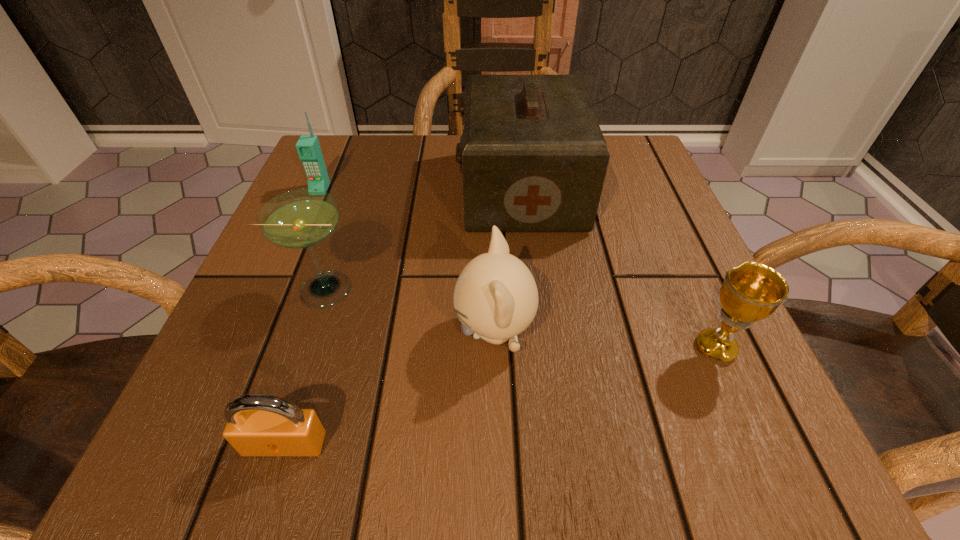
Point out which object is positioned as the fifth nearest to the first-aid kit. Please provide its 2D coordinates. Your answer should be formatted as a tuple, i.e. [(x, y)], where the tuple contains the x and y coordinates of a point satisfying the conditions above.

[(257, 424)]

Select which object is the third closest to the tallest object. Please provide its 2D coordinates. Your answer should be formatted as a tuple, i.e. [(x, y)], where the tuple contains the x and y coordinates of a point satisfying the conditions above.

[(751, 292)]

Locate an element on the screen. This screenshot has height=540, width=960. free point that satisfies the following two spatial constraints: 1. on the keypad of the cellular telephone; 2. on the right side of the chalice is located at coordinates (252, 348).

The width and height of the screenshot is (960, 540). Identify the location of free point that satisfies the following two spatial constraints: 1. on the face of the kitten; 2. on the back side of the rightmost object. (495, 348).

Locate an element on the screen. This screenshot has height=540, width=960. free space that satisfies the following two spatial constraints: 1. on the face of the rightmost object; 2. on the left side of the kitten is located at coordinates (495, 348).

At what (x,y) coordinates should I click in order to perform the action: click on free region that satisfies the following two spatial constraints: 1. on the back side of the rightmost object; 2. on the face of the kitten. Please return your answer as a coordinate pair (x, y). The height and width of the screenshot is (540, 960). Looking at the image, I should click on coord(708,332).